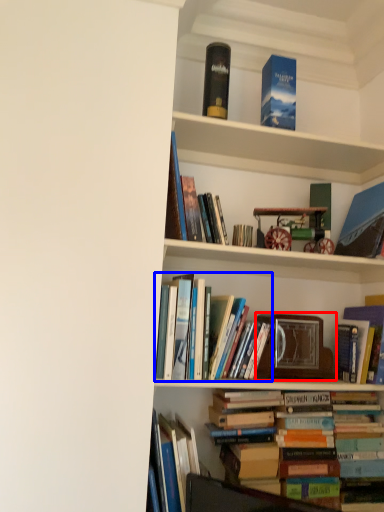
Question: Which object appears farthest to the camera in this image, picture frame (highlighted by a red box) or book (highlighted by a blue box)?

Choices:
 (A) picture frame
 (B) book

Answer: (A)